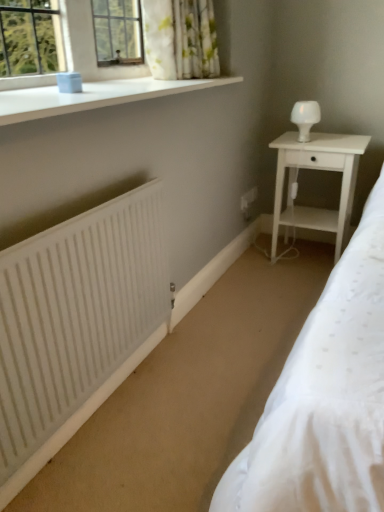
Question: Considering the relative positions of white glossy table lamp at upper right and white smooth window sill at upper left in the image provided, is white glossy table lamp at upper right behind white smooth window sill at upper left?

Choices:
 (A) yes
 (B) no

Answer: (A)

Question: Can you confirm if white glossy table lamp at upper right is wider than white smooth window sill at upper left?

Choices:
 (A) no
 (B) yes

Answer: (A)

Question: Is white glossy table lamp at upper right positioned beyond the bounds of white smooth window sill at upper left?

Choices:
 (A) yes
 (B) no

Answer: (A)

Question: Considering the relative sizes of white glossy table lamp at upper right and white smooth window sill at upper left in the image provided, is white glossy table lamp at upper right bigger than white smooth window sill at upper left?

Choices:
 (A) yes
 (B) no

Answer: (B)

Question: Is white smooth window sill at upper left a part of white glossy table lamp at upper right?

Choices:
 (A) no
 (B) yes

Answer: (A)

Question: Are white glossy table lamp at upper right and white smooth window sill at upper left making contact?

Choices:
 (A) no
 (B) yes

Answer: (A)

Question: From the image's perspective, is white matte radiator at lower left below white wood nightstand at right?

Choices:
 (A) yes
 (B) no

Answer: (A)

Question: Is the depth of white matte radiator at lower left less than that of white wood nightstand at right?

Choices:
 (A) yes
 (B) no

Answer: (A)

Question: Does white matte radiator at lower left lie behind white wood nightstand at right?

Choices:
 (A) yes
 (B) no

Answer: (B)

Question: From the image's perspective, would you say white matte radiator at lower left is positioned over white wood nightstand at right?

Choices:
 (A) no
 (B) yes

Answer: (A)

Question: Is white matte radiator at lower left touching white wood nightstand at right?

Choices:
 (A) no
 (B) yes

Answer: (A)

Question: Considering the relative sizes of white matte radiator at lower left and white wood nightstand at right in the image provided, is white matte radiator at lower left bigger than white wood nightstand at right?

Choices:
 (A) yes
 (B) no

Answer: (B)

Question: Is white wood nightstand at right directly adjacent to white matte radiator at lower left?

Choices:
 (A) yes
 (B) no

Answer: (B)